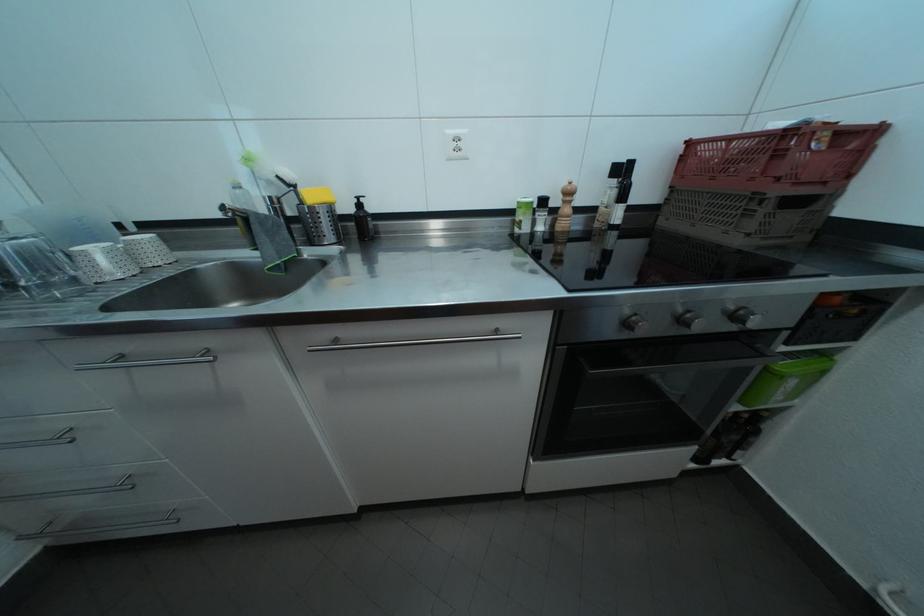
The location [317,196] corresponds to which object?

This point indicates the yellow sponge.